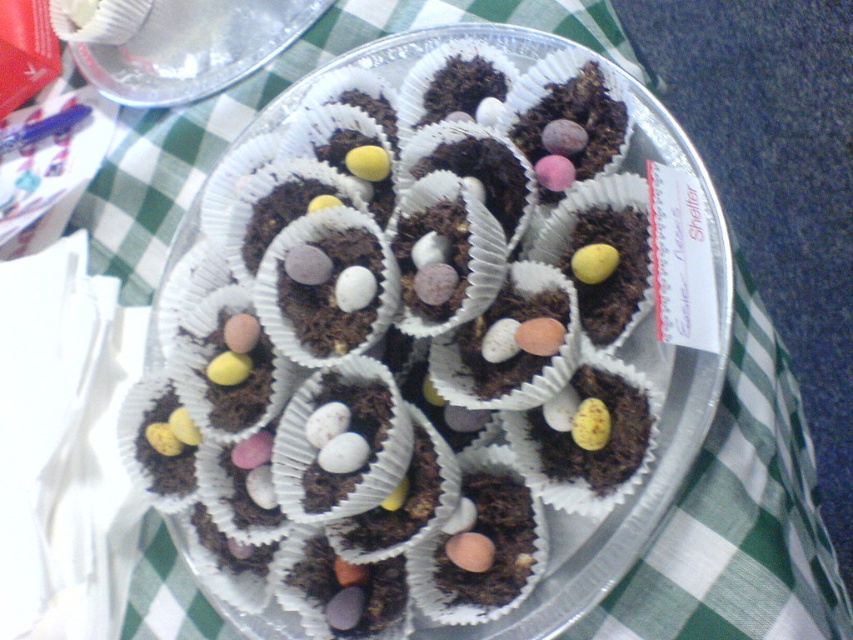
You are a photographer trying to capture the chocolate cake at center for a closeup shot. If your camera can focus on objects within 20 inches, will you need to move closer or farther away to get a clear photo?

The chocolate cake at center is 22.21 inches away from camera. Since the camera can focus within 20 inches, you need to move closer to the chocolate cake at center to get a clear photo.

You are planning to serve a dessert and have a transparent plastic plate at upper center. Can the chocolate cake at center fit on it?

The chocolate cake at center is larger in size than the transparent plastic plate at upper center, so it cannot fit on the plate.

You are at a party and see a tray with chocolate cake at center and a transparent plastic plate at upper center. Where is the chocolate cake located relative to the transparent plastic plate?

The chocolate cake at center is to the right of the transparent plastic plate at upper center.